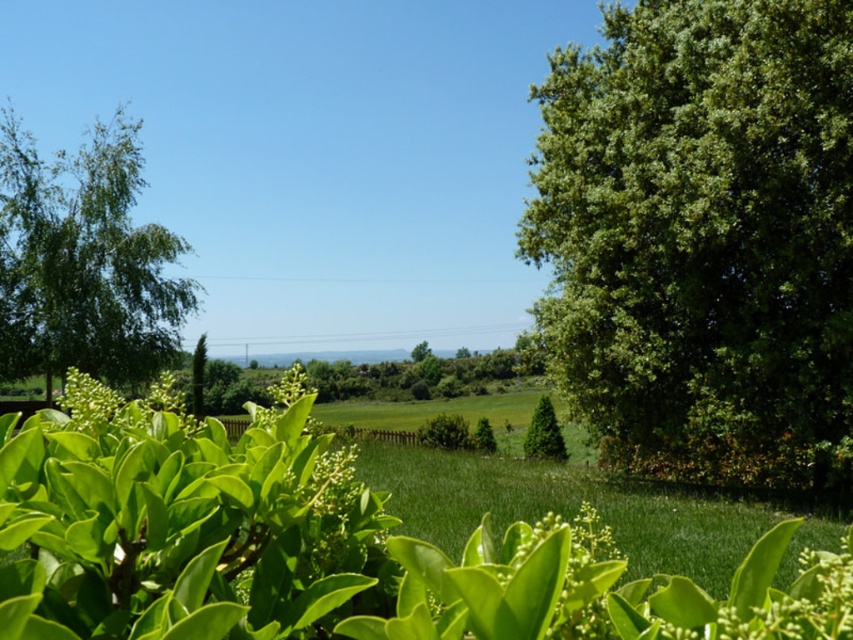
Question: Which point is farther to the camera?

Choices:
 (A) green leafy bush at center
 (B) green matte evergreen tree at center

Answer: (A)

Question: Observing the image, what is the correct spatial positioning of green leafy tree at right in reference to green leafy tree at left?

Choices:
 (A) right
 (B) left

Answer: (A)

Question: Is green leafy tree at right closer to the viewer compared to green matte evergreen tree at center?

Choices:
 (A) yes
 (B) no

Answer: (A)

Question: Which of the following is the farthest from the observer?

Choices:
 (A) [479, 438]
 (B) [146, 342]
 (C) [547, 422]
 (D) [740, 262]

Answer: (C)

Question: Which object appears closest to the camera in this image?

Choices:
 (A) green leafy bush at center
 (B) green leafy tree at right
 (C) green matte evergreen tree at center
 (D) green leafy tree at left

Answer: (B)

Question: Is green leafy tree at right wider than green matte evergreen tree at center?

Choices:
 (A) no
 (B) yes

Answer: (B)